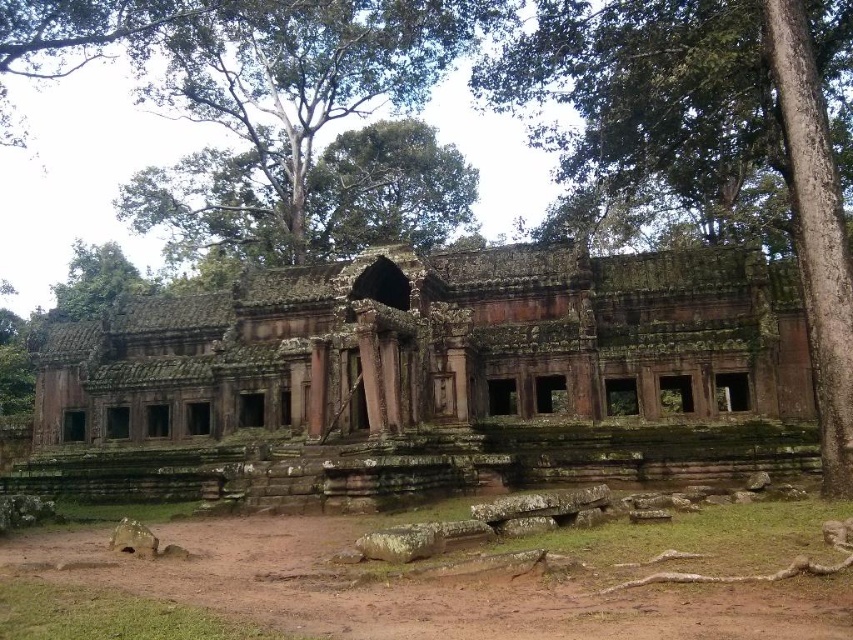
Question: Does green rough bark tree at upper center have a larger size compared to green leafy tree at upper center?

Choices:
 (A) no
 (B) yes

Answer: (A)

Question: Which object is farther from the camera taking this photo?

Choices:
 (A) green leafy tree at upper center
 (B) pink stone ruins at center

Answer: (A)

Question: Which point is farther from the camera taking this photo?

Choices:
 (A) (712, 150)
 (B) (474, 483)
 (C) (254, 154)

Answer: (C)

Question: Can you confirm if pink stone ruins at center is wider than green rough bark tree at upper center?

Choices:
 (A) no
 (B) yes

Answer: (B)

Question: Which point appears closest to the camera in this image?

Choices:
 (A) (264, 193)
 (B) (503, 269)

Answer: (B)

Question: Where is pink stone ruins at center located in relation to green leafy tree at upper center in the image?

Choices:
 (A) below
 (B) above

Answer: (A)